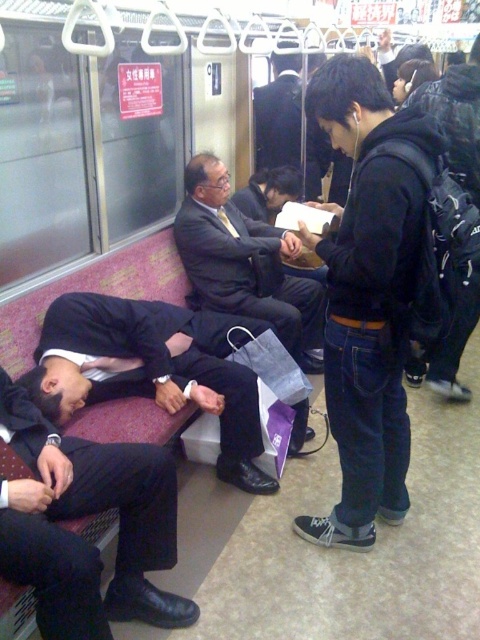
Question: Which of the following is the farthest from the observer?

Choices:
 (A) black suit at lower left
 (B) matte black suit at center

Answer: (B)

Question: Is black suit at lower left to the left of matte black suit at center from the viewer's perspective?

Choices:
 (A) yes
 (B) no

Answer: (A)

Question: Is black suit at lower left positioned behind matte black suit at center?

Choices:
 (A) no
 (B) yes

Answer: (A)

Question: Which object is farther from the camera taking this photo?

Choices:
 (A) dark blue suit at center
 (B) black suit at lower left

Answer: (A)

Question: Can you confirm if black suit at lower left is bigger than dark blue suit at center?

Choices:
 (A) yes
 (B) no

Answer: (B)

Question: Which of the following is the closest to the observer?

Choices:
 (A) (395, 266)
 (B) (63, 611)

Answer: (B)